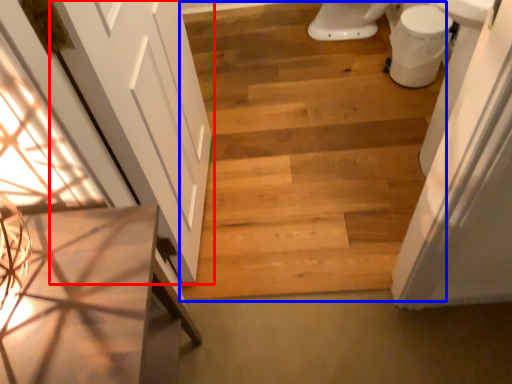
Question: Which object appears closest to the camera in this image, door (highlighted by a red box) or stairwell (highlighted by a blue box)?

Choices:
 (A) door
 (B) stairwell

Answer: (A)